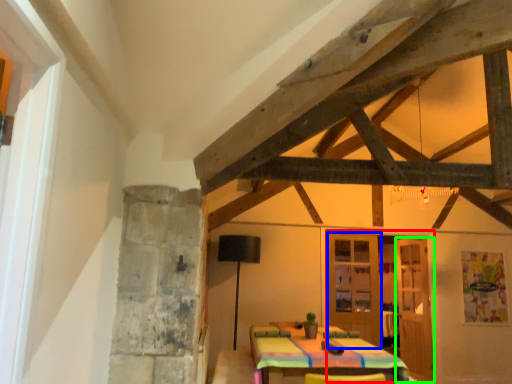
Question: Which is farther away from door (highlighted by a red box)? door (highlighted by a blue box) or door (highlighted by a green box)?

Choices:
 (A) door
 (B) door

Answer: (A)